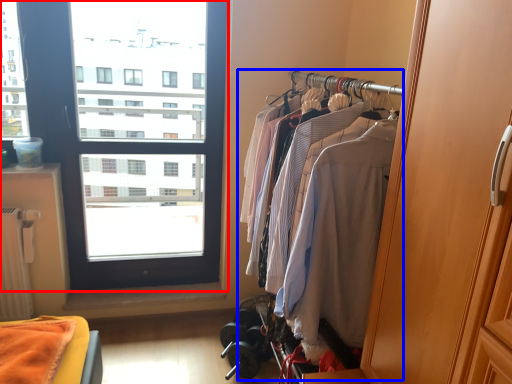
Question: Which of the following is the farthest to the observer, window (highlighted by a red box) or closet (highlighted by a blue box)?

Choices:
 (A) window
 (B) closet

Answer: (A)